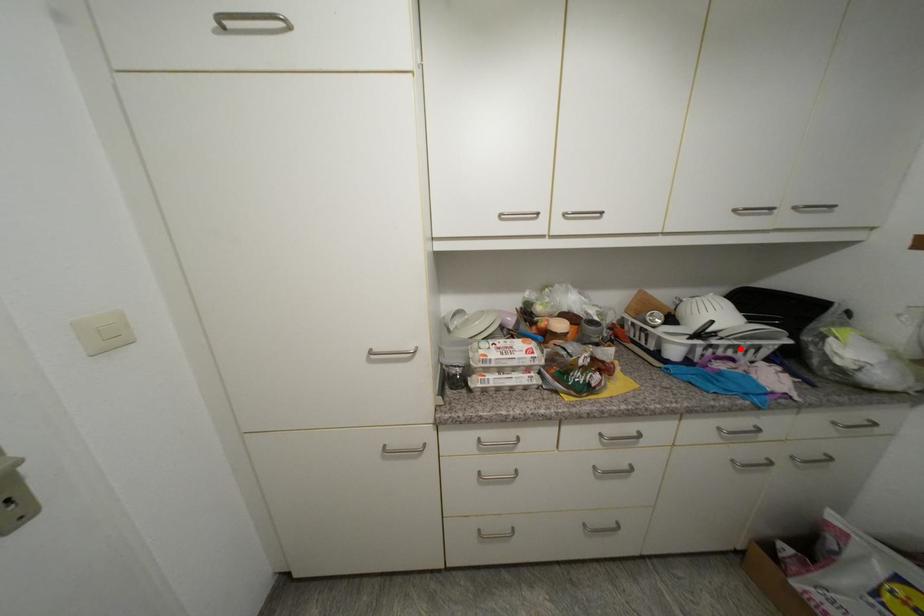
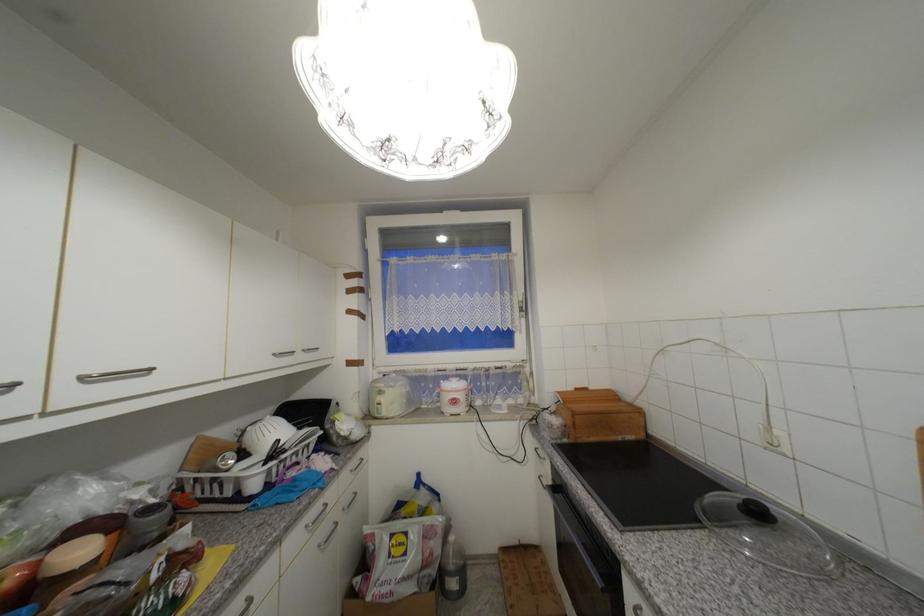
The point at the highlighted location is marked in the first image. Where is the corresponding point in the second image?

(301, 454)